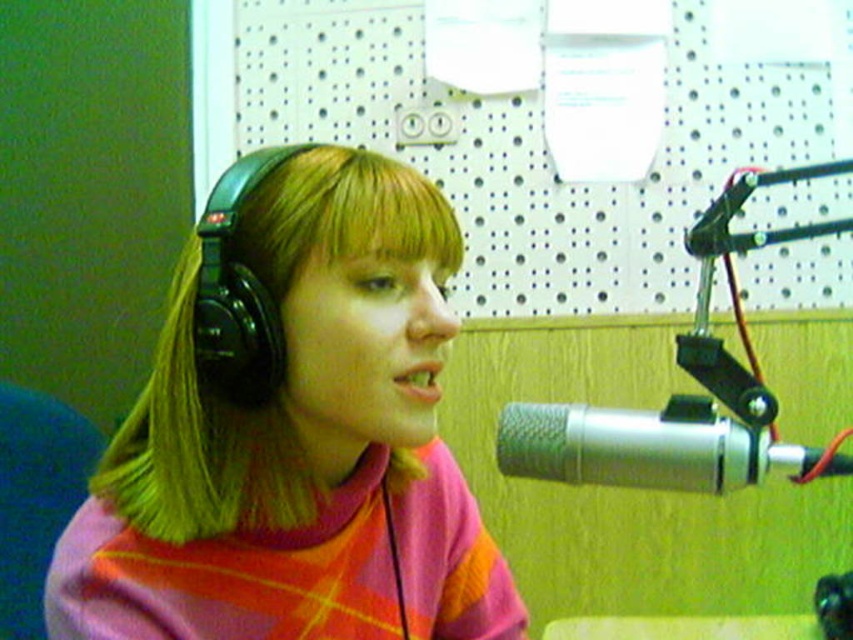
Question: Among these objects, which one is nearest to the camera?

Choices:
 (A) silver/metallic microphone at right
 (B) matte black headphones at left

Answer: (B)

Question: Which of the following is the farthest from the observer?

Choices:
 (A) (276, 528)
 (B) (709, 401)

Answer: (B)

Question: Can you confirm if matte black headphones at left is positioned below silver/metallic microphone at right?

Choices:
 (A) yes
 (B) no

Answer: (A)

Question: Considering the relative positions of matte black headphones at left and silver/metallic microphone at right in the image provided, where is matte black headphones at left located with respect to silver/metallic microphone at right?

Choices:
 (A) above
 (B) below

Answer: (B)

Question: Can you confirm if matte black headphones at left is positioned below silver/metallic microphone at right?

Choices:
 (A) yes
 (B) no

Answer: (A)